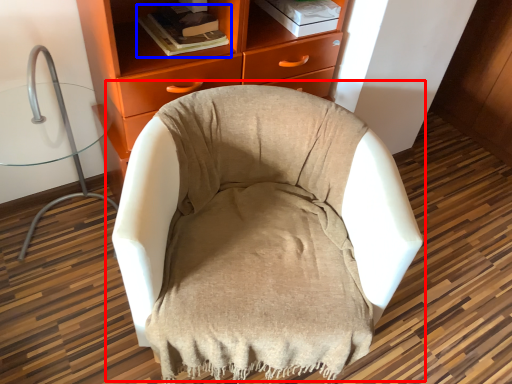
Question: Which of the following is the farthest to the observer, chair (highlighted by a red box) or book (highlighted by a blue box)?

Choices:
 (A) chair
 (B) book

Answer: (B)